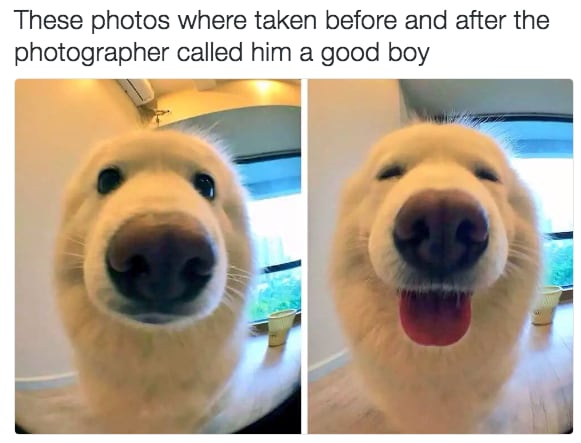
This screenshot has width=581, height=443. Find the location of `floor`. floor is located at coordinates (272, 388), (48, 412), (355, 417), (544, 397).